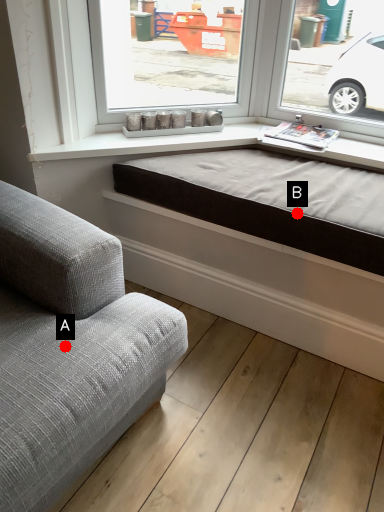
Question: Two points are circled on the image, labeled by A and B beside each circle. Among these points, which one is farthest from the camera?

Choices:
 (A) A is further
 (B) B is further

Answer: (B)